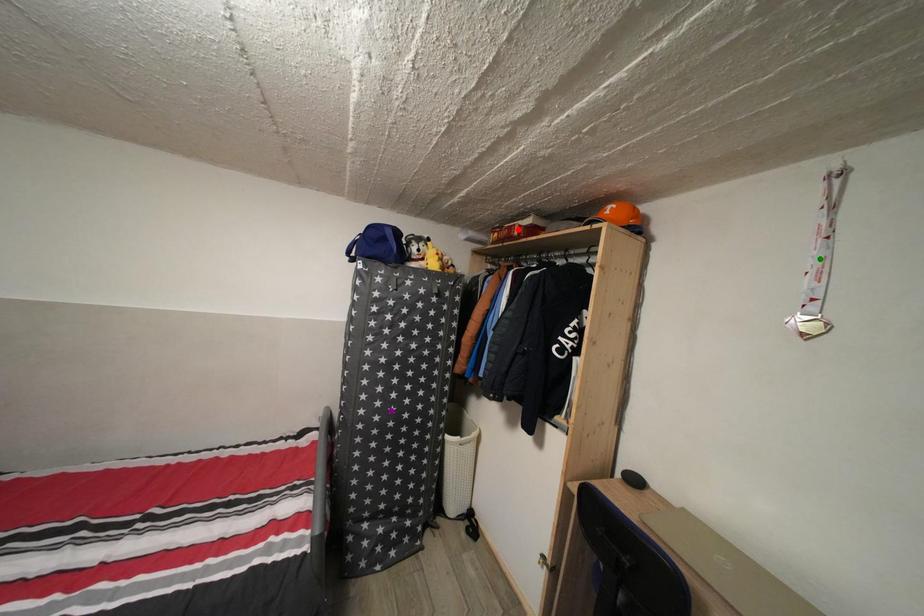
Consider the image. Order these from nearest to farthest:
green point | red point | purple point

green point
purple point
red point